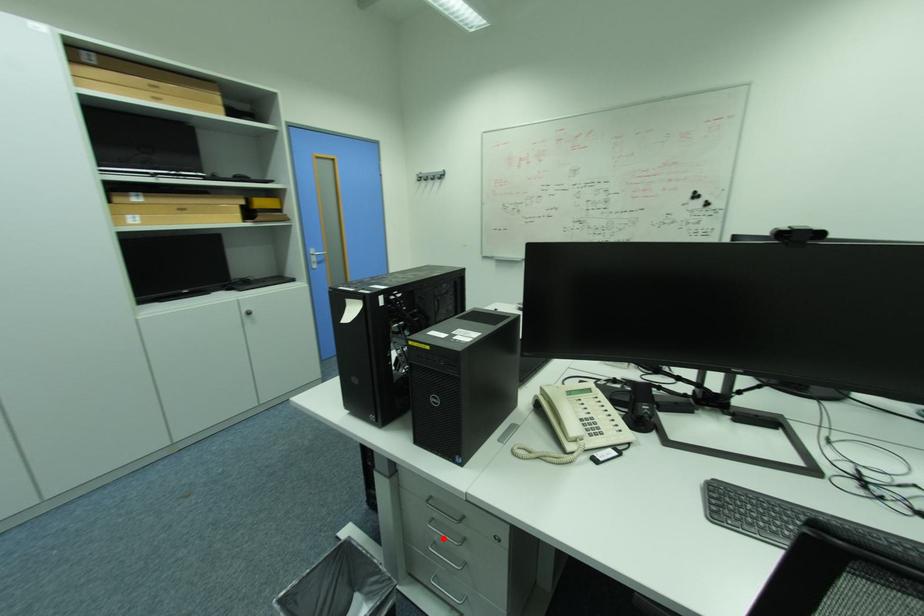
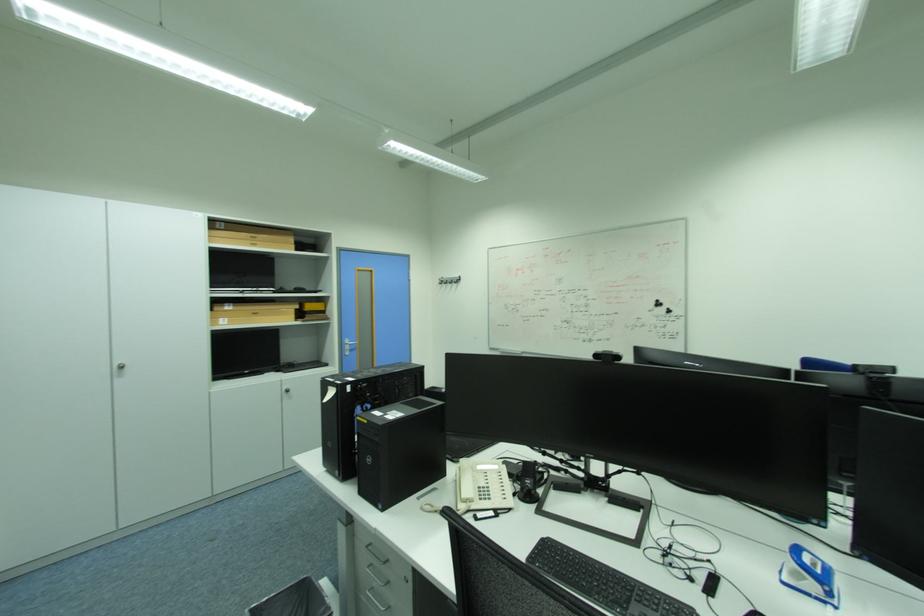
Question: I am providing you with two images of the same scene from different viewpoints. Image1 has a red point marked. In image2, the corresponding 3D location appears at what relative position? Reply with the corresponding letter.

Choices:
 (A) Closer
 (B) Farther

Answer: (A)